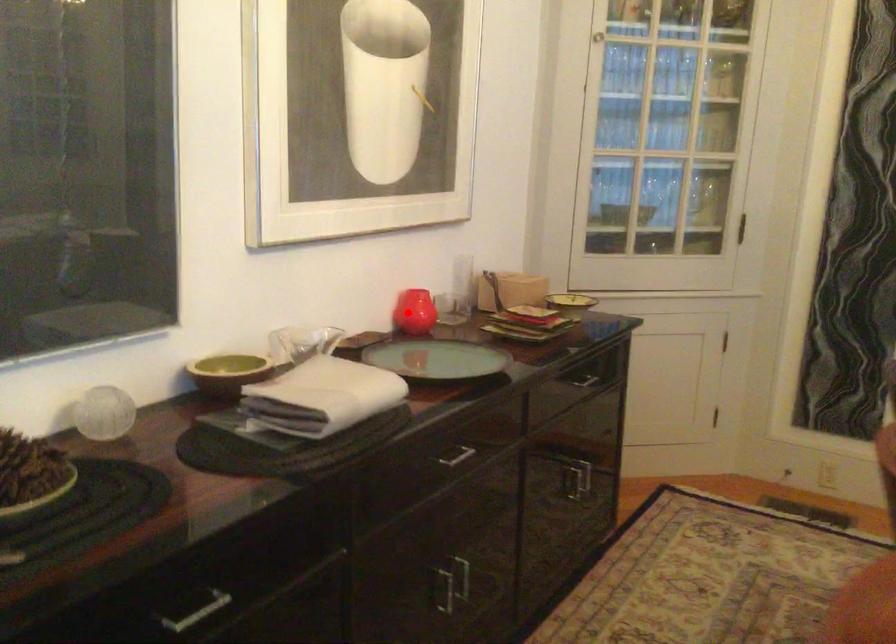
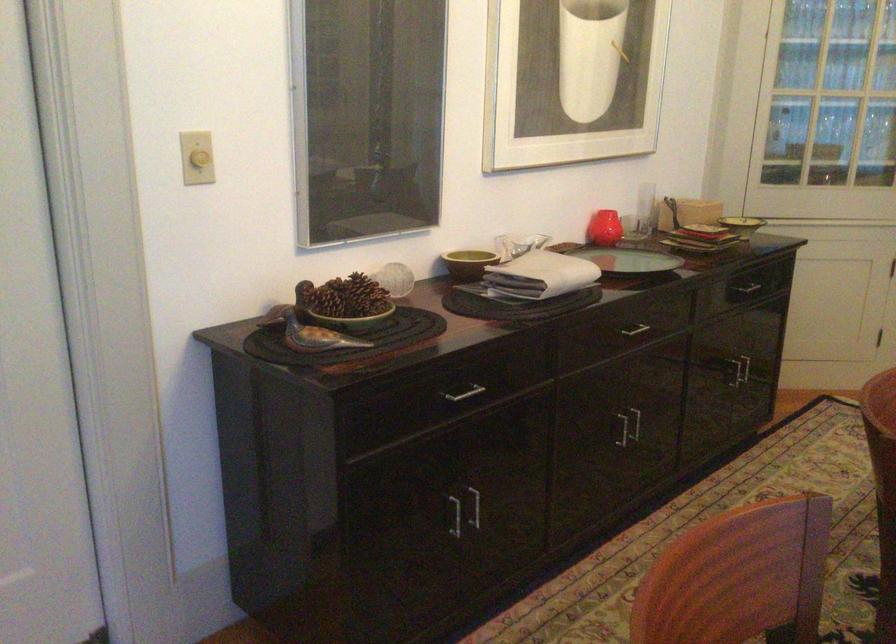
Question: I am providing you with two images of the same scene from different viewpoints. A red point is shown in image1. For the corresponding object point in image2, is it positioned nearer or farther from the camera?

Choices:
 (A) Nearer
 (B) Farther

Answer: (B)